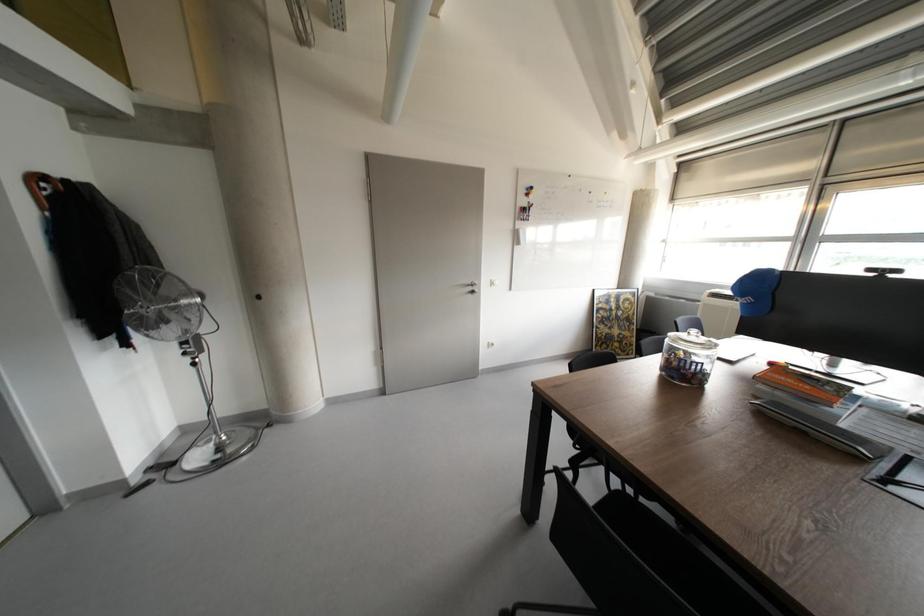
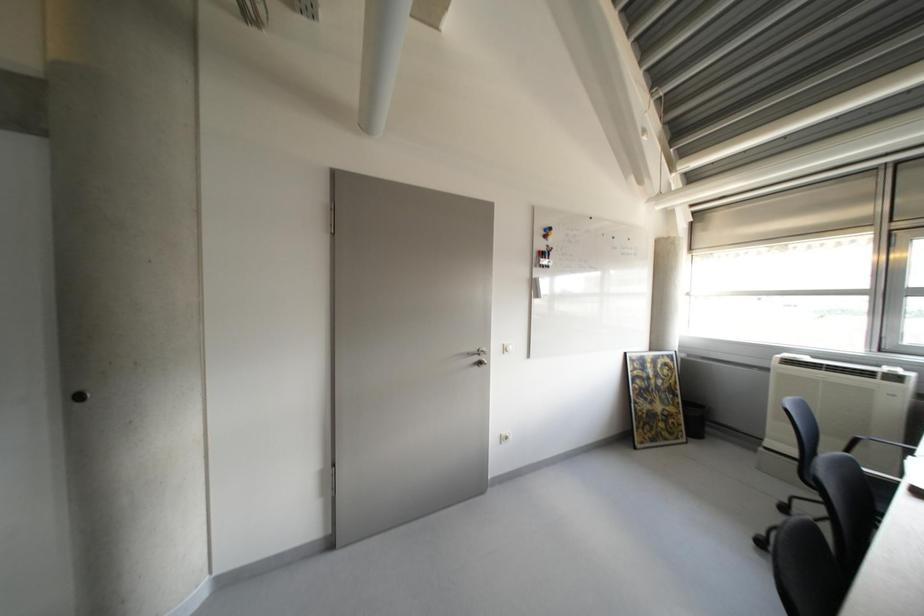
Question: The first image is from the beginning of the video and the second image is from the end. How did the camera likely rotate when shooting the video?

Choices:
 (A) Left
 (B) Right
 (C) Up
 (D) Down

Answer: (C)